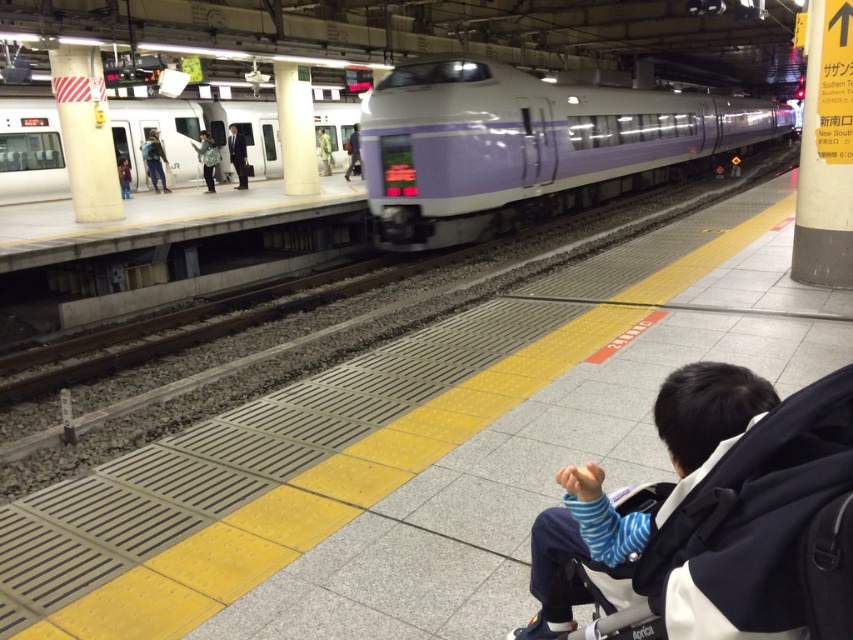
Question: Which of the following is the farthest from the observer?

Choices:
 (A) white glossy train at left
 (B) yellow signpost at upper right

Answer: (A)

Question: From the image, what is the correct spatial relationship of yellow signpost at upper right in relation to blue jeans at left?

Choices:
 (A) above
 (B) below

Answer: (B)

Question: Which point is farther to the camera?

Choices:
 (A) dark suit at platform left
 (B) camouflage fabric jacket at center
 (C) yellow signpost at upper right

Answer: (B)

Question: Does purple glossy train at center have a lesser width compared to blue jeans at left?

Choices:
 (A) no
 (B) yes

Answer: (A)

Question: Is purple glossy train at center closer to camera compared to dark suit at platform left?

Choices:
 (A) yes
 (B) no

Answer: (A)

Question: Which point appears closest to the camera in this image?

Choices:
 (A) (830, 472)
 (B) (3, 195)

Answer: (A)